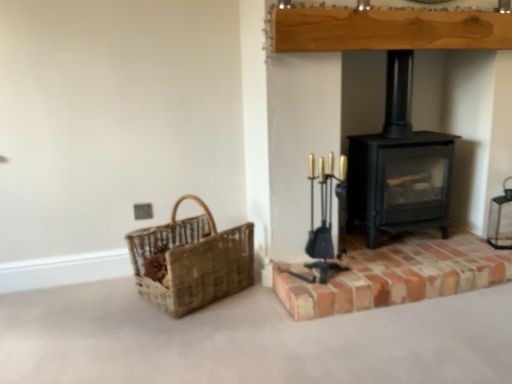
Question: From the image's perspective, is woven natural basket at left positioned above or below black matte wood burning stove at center-right?

Choices:
 (A) below
 (B) above

Answer: (A)

Question: Is woven natural basket at left wider or thinner than black matte wood burning stove at center-right?

Choices:
 (A) wide
 (B) thin

Answer: (B)

Question: Which is nearer to the woven natural basket at left?

Choices:
 (A) black matte wood burning stove at center-right
 (B) brick at right

Answer: (B)

Question: Based on their relative distances, which object is farther from the black matte wood burning stove at center-right?

Choices:
 (A) woven natural basket at left
 (B) brick at right

Answer: (A)